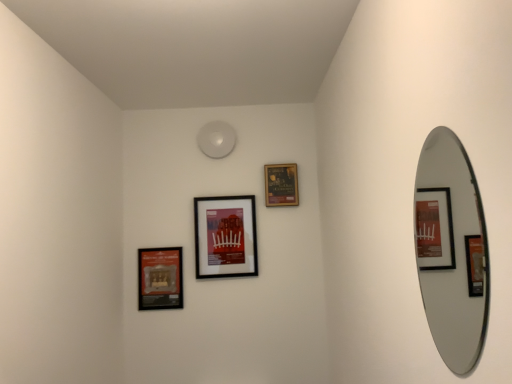
Question: Is silver metallic mirror at right oriented towards matte black picture frame at lower left, which appears as the first picture frame when viewed from the left?

Choices:
 (A) yes
 (B) no

Answer: (B)

Question: From a real-world perspective, is silver metallic mirror at right on matte black picture frame at lower left, which appears as the first picture frame when viewed from the left?

Choices:
 (A) no
 (B) yes

Answer: (B)

Question: From a real-world perspective, is silver metallic mirror at right beneath matte black picture frame at lower left, which appears as the first picture frame when viewed from the left?

Choices:
 (A) no
 (B) yes

Answer: (A)

Question: Considering the relative sizes of silver metallic mirror at right and matte black picture frame at lower left, which appears as the first picture frame when viewed from the left, in the image provided, is silver metallic mirror at right thinner than matte black picture frame at lower left, which appears as the first picture frame when viewed from the left,?

Choices:
 (A) no
 (B) yes

Answer: (B)

Question: Is silver metallic mirror at right located outside matte black picture frame at lower left, which appears as the first picture frame when viewed from the left?

Choices:
 (A) no
 (B) yes

Answer: (B)

Question: Is point (166, 261) closer or farther from the camera than point (216, 276)?

Choices:
 (A) closer
 (B) farther

Answer: (B)

Question: In terms of height, does matte black picture frame at lower left, the 3th picture frame from the right, look taller or shorter compared to matte black picture frame at center, the second picture frame positioned from the left?

Choices:
 (A) tall
 (B) short

Answer: (B)

Question: Visually, is matte black picture frame at lower left, the 3th picture frame from the right, positioned to the left or to the right of matte black picture frame at center, the second picture frame positioned from the left?

Choices:
 (A) right
 (B) left

Answer: (B)

Question: Is matte black picture frame at lower left, which appears as the first picture frame when viewed from the left, in front of or behind matte black picture frame at center, the second picture frame positioned from the left, in the image?

Choices:
 (A) behind
 (B) front

Answer: (A)

Question: Considering the positions of point (272, 177) and point (474, 304), is point (272, 177) closer or farther from the camera than point (474, 304)?

Choices:
 (A) farther
 (B) closer

Answer: (A)

Question: Looking at the image, does matte black picture frame at upper center, arranged as the 1th picture frame when viewed from the right, seem bigger or smaller compared to silver metallic mirror at right?

Choices:
 (A) big
 (B) small

Answer: (B)

Question: From a real-world perspective, relative to silver metallic mirror at right, is matte black picture frame at upper center, arranged as the 1th picture frame when viewed from the right, vertically above or below?

Choices:
 (A) above
 (B) below

Answer: (A)

Question: Visually, is matte black picture frame at upper center, arranged as the 1th picture frame when viewed from the right, positioned to the left or to the right of silver metallic mirror at right?

Choices:
 (A) left
 (B) right

Answer: (A)

Question: In terms of height, does matte black picture frame at center, the second picture frame positioned from the left, look taller or shorter compared to silver metallic mirror at right?

Choices:
 (A) short
 (B) tall

Answer: (A)

Question: From the image's perspective, is matte black picture frame at center, the second picture frame positioned from the left, positioned above or below silver metallic mirror at right?

Choices:
 (A) below
 (B) above

Answer: (A)